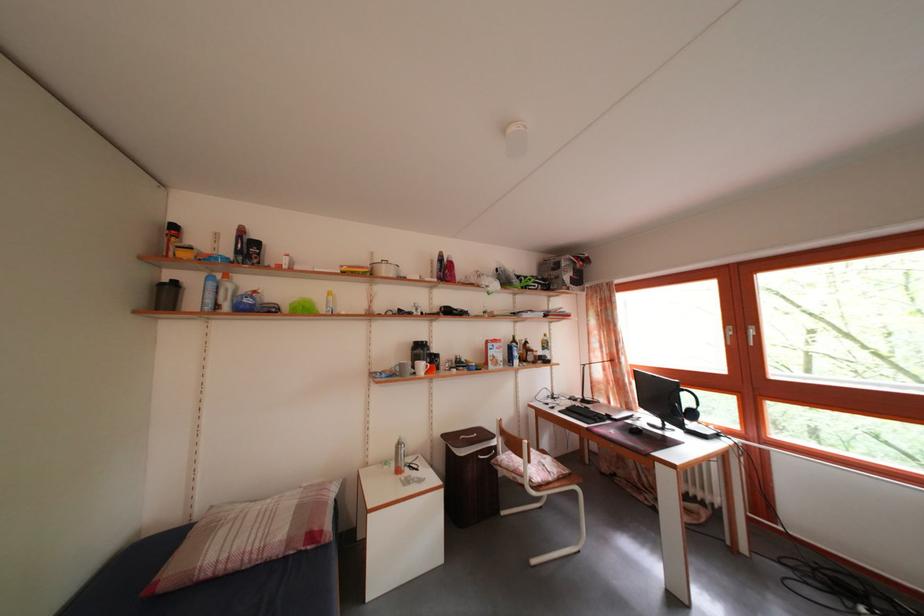
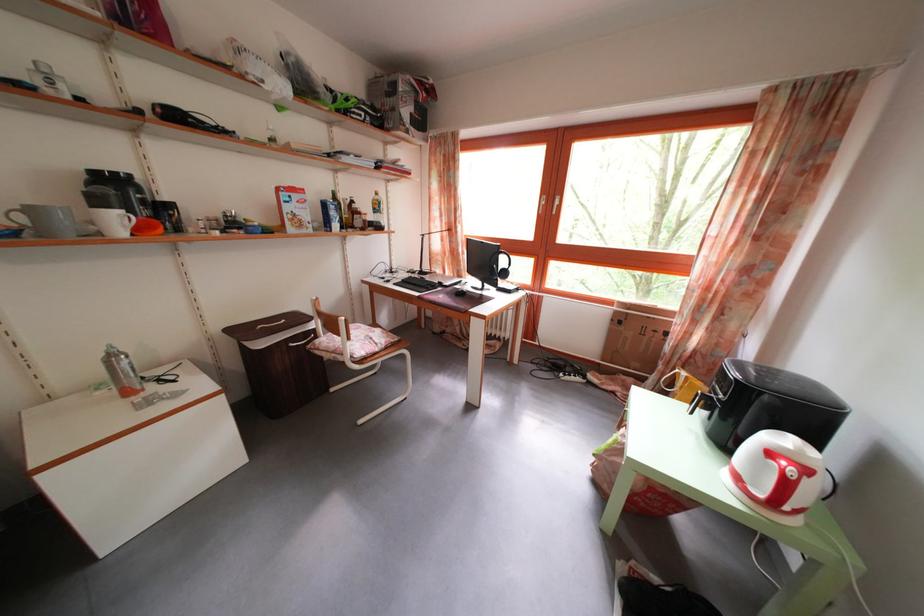
Where in the second image is the point corresponding to (521,355) from the first image?

(338, 214)